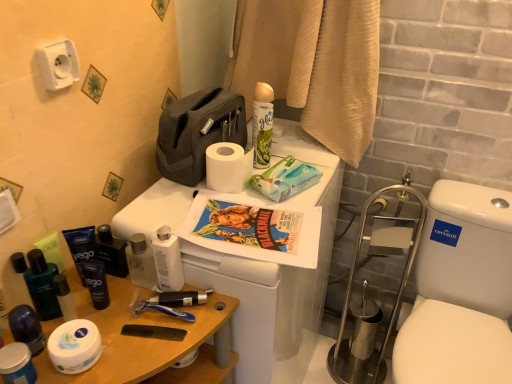
The image size is (512, 384). Find the location of `white matte toilet paper at lower left, which ranks as the 2th toilet paper in right-to-left order`. white matte toilet paper at lower left, which ranks as the 2th toilet paper in right-to-left order is located at coordinates (74, 346).

At what (x,y) coordinates should I click in order to perform the action: click on matte white jar at lower left, placed as the third toiletry when sorted from left to right. Please return your answer as a coordinate pair (x, y). The height and width of the screenshot is (384, 512). Looking at the image, I should click on (17, 364).

Consider the image. Measure the distance between point [30,353] and camera.

Point [30,353] is 28.43 inches away from camera.

What do you see at coordinates (285, 179) in the screenshot? The width and height of the screenshot is (512, 384). I see `white paper towels at center` at bounding box center [285, 179].

You are a GUI agent. You are given a task and a screenshot of the screen. Output one action in this format:
    pyautogui.click(x=<x>, y=<y>)
    Task: Click on the white glossy toilet seat at right
    The height and width of the screenshot is (384, 512).
    Given the screenshot: What is the action you would take?
    pyautogui.click(x=460, y=291)

Can we say matte black shaving cream at left, which is counted as the third toiletry, starting from the right, lies outside white glossy toilet seat at right?

matte black shaving cream at left, which is counted as the third toiletry, starting from the right, lies outside white glossy toilet seat at right's area.

Considering the sizes of objects matte black shaving cream at left, which appears as the 5th toiletry when viewed from the left, and white glossy toilet seat at right in the image provided, who is bigger, matte black shaving cream at left, which appears as the 5th toiletry when viewed from the left, or white glossy toilet seat at right?

white glossy toilet seat at right is bigger.

Is the depth of matte black shaving cream at left, which is counted as the third toiletry, starting from the right, greater than that of white glossy toilet seat at right?

That is True.

Considering the relative sizes of matte black shaving cream at left, which is counted as the third toiletry, starting from the right, and white glossy toilet seat at right in the image provided, is matte black shaving cream at left, which is counted as the third toiletry, starting from the right, thinner than white glossy toilet seat at right?

Indeed, matte black shaving cream at left, which is counted as the third toiletry, starting from the right, has a lesser width compared to white glossy toilet seat at right.

Between shiny black bottles at lower left, which appears as the 1th toiletry when viewed from the left, and white matte lotion at center, which appears as the seventh toiletry when viewed from the left, which one has smaller size?

Smaller between the two is shiny black bottles at lower left, which appears as the 1th toiletry when viewed from the left.

Is shiny black bottles at lower left, marked as the 7th toiletry in a right-to-left arrangement, oriented towards white matte lotion at center, the 1th toiletry when ordered from right to left?

No, shiny black bottles at lower left, marked as the 7th toiletry in a right-to-left arrangement, is not facing towards white matte lotion at center, the 1th toiletry when ordered from right to left.

How many degrees apart are the facing directions of shiny black bottles at lower left, marked as the 7th toiletry in a right-to-left arrangement, and white matte lotion at center, the 1th toiletry when ordered from right to left?

The angle between the facing direction of shiny black bottles at lower left, marked as the 7th toiletry in a right-to-left arrangement, and the facing direction of white matte lotion at center, the 1th toiletry when ordered from right to left, is 88 degrees.

Is the position of shiny black bottles at lower left, marked as the 7th toiletry in a right-to-left arrangement, less distant than that of white matte lotion at center, which appears as the seventh toiletry when viewed from the left?

Yes, the depth of shiny black bottles at lower left, marked as the 7th toiletry in a right-to-left arrangement, is less than that of white matte lotion at center, which appears as the seventh toiletry when viewed from the left.

You are a GUI agent. You are given a task and a screenshot of the screen. Output one action in this format:
    pyautogui.click(x=<x>, y=<y>)
    Task: Click on the table in front of the dark blue matte tube at left, which ranks as the sixth toiletry in left-to-right order
    The width and height of the screenshot is (512, 384).
    Given the screenshot: What is the action you would take?
    pyautogui.click(x=150, y=341)

Is dark blue matte tube at left, which ranks as the sixth toiletry in left-to-right order, wider or thinner than wooden table at lower left?

In the image, dark blue matte tube at left, which ranks as the sixth toiletry in left-to-right order, appears to be more narrow than wooden table at lower left.

Is dark blue matte tube at left, marked as the 2th toiletry in a right-to-left arrangement, to the left of wooden table at lower left from the viewer's perspective?

Yes.

Is dark blue matte tube at left, which ranks as the sixth toiletry in left-to-right order, placed right next to wooden table at lower left?

dark blue matte tube at left, which ranks as the sixth toiletry in left-to-right order, is not next to wooden table at lower left, and they're not touching.

From a real-world perspective, is white paper towels at center above or below green matte spray can at upper center?

From a real-world perspective, white paper towels at center is physically below green matte spray can at upper center.

From the picture: Is white paper towels at center wider than green matte spray can at upper center?

Yes.

From the picture: How different are the orientations of white paper towels at center and green matte spray can at upper center in degrees?

14.5 degrees.

Which is in front, white paper towels at center or green matte spray can at upper center?

white paper towels at center is closer to the camera.

How many degrees apart are the facing directions of white matte lotion at center, which appears as the seventh toiletry when viewed from the left, and dark blue matte tube at left, which ranks as the sixth toiletry in left-to-right order?

white matte lotion at center, which appears as the seventh toiletry when viewed from the left, and dark blue matte tube at left, which ranks as the sixth toiletry in left-to-right order, are facing 13.4 degrees away from each other.

Based on the photo, between white matte lotion at center, the 1th toiletry when ordered from right to left, and dark blue matte tube at left, marked as the 2th toiletry in a right-to-left arrangement, which one is positioned in front?

Positioned in front is white matte lotion at center, the 1th toiletry when ordered from right to left.

Can we say white matte lotion at center, which appears as the seventh toiletry when viewed from the left, lies outside dark blue matte tube at left, which ranks as the sixth toiletry in left-to-right order?

Yes, white matte lotion at center, which appears as the seventh toiletry when viewed from the left, is located beyond the bounds of dark blue matte tube at left, which ranks as the sixth toiletry in left-to-right order.

In the scene shown: From the image's perspective, is white matte lotion at center, which appears as the seventh toiletry when viewed from the left, under dark blue matte tube at left, marked as the 2th toiletry in a right-to-left arrangement?

No.

Considering the sizes of objects wooden table at lower left and matte black shaving cream at left, positioned as the 2th toiletry in left-to-right order, in the image provided, who is bigger, wooden table at lower left or matte black shaving cream at left, positioned as the 2th toiletry in left-to-right order,?

Bigger between the two is wooden table at lower left.

Based on the photo, which is in front, wooden table at lower left or matte black shaving cream at left, positioned as the 2th toiletry in left-to-right order?

wooden table at lower left is more forward.

From the image's perspective, is wooden table at lower left positioned above or below matte black shaving cream at left, positioned as the sixth toiletry in right-to-left order?

wooden table at lower left is below matte black shaving cream at left, positioned as the sixth toiletry in right-to-left order.

Is wooden table at lower left positioned far away from matte black shaving cream at left, positioned as the sixth toiletry in right-to-left order?

No, wooden table at lower left is not far away from matte black shaving cream at left, positioned as the sixth toiletry in right-to-left order.

Is white matte toilet paper at center, the 1th toilet paper positioned from the right, thinner than blue matte tube at left, which is the 4th toiletry from right to left?

Incorrect, the width of white matte toilet paper at center, the 1th toilet paper positioned from the right, is not less than that of blue matte tube at left, which is the 4th toiletry from right to left.

Relative to blue matte tube at left, positioned as the 4th toiletry in left-to-right order, is white matte toilet paper at center, the 1th toilet paper positioned from the right, in front or behind?

white matte toilet paper at center, the 1th toilet paper positioned from the right, is behind blue matte tube at left, positioned as the 4th toiletry in left-to-right order.

Who is smaller, white matte toilet paper at center, which is the first toilet paper from back to front, or blue matte tube at left, which is the 4th toiletry from right to left?

blue matte tube at left, which is the 4th toiletry from right to left, is smaller.

Between white matte toilet paper at center, placed as the first toilet paper when sorted from top to bottom, and blue matte tube at left, which is the 4th toiletry from right to left, which one appears on the left side from the viewer's perspective?

blue matte tube at left, which is the 4th toiletry from right to left.

In the image, there is a matte black shaving cream at left, which appears as the 5th toiletry when viewed from the left. What are the coordinates of `sit below it (from a real-world perspective)` in the screenshot? It's located at [x=460, y=291].

The width and height of the screenshot is (512, 384). Identify the location of the 4th toiletry directly above the shiny black bottles at lower left, which appears as the 1th toiletry when viewed from the left (from a real-world perspective). (167, 260).

Based on their spatial positions, is blue matte tube at left, positioned as the 4th toiletry in left-to-right order, or white glossy toilet seat at right further from matte white jar at lower left, placed as the third toiletry when sorted from left to right?

white glossy toilet seat at right is further to matte white jar at lower left, placed as the third toiletry when sorted from left to right.

When comparing their distances from white matte toilet paper at lower left, which is the first toilet paper from bottom to top, does green matte spray can at upper center or dark blue matte tube at left, marked as the 2th toiletry in a right-to-left arrangement, seem closer?

dark blue matte tube at left, marked as the 2th toiletry in a right-to-left arrangement.

Based on their spatial positions, is green matte spray can at upper center or white paper towels at center closer to white matte toilet paper at center, the 1th toilet paper positioned from the right?

Among the two, white paper towels at center is located nearer to white matte toilet paper at center, the 1th toilet paper positioned from the right.

Based on their spatial positions, is white plastic toilet at upper center or white paper towels at center further from dark blue matte tube at left, which ranks as the sixth toiletry in left-to-right order?

white paper towels at center.

Considering their positions, is matte white jar at lower left, placed as the third toiletry when sorted from left to right, positioned closer to white plastic toilet at upper center than shiny black bottles at lower left, which appears as the 1th toiletry when viewed from the left?

Among the two, shiny black bottles at lower left, which appears as the 1th toiletry when viewed from the left, is located nearer to white plastic toilet at upper center.

Estimate the real-world distances between objects in this image. Which object is closer to white matte toilet paper at center, the 2th toilet paper in the bottom-to-top sequence, matte black shaving cream at left, which appears as the 5th toiletry when viewed from the left, or shiny black bottles at lower left, marked as the 7th toiletry in a right-to-left arrangement?

matte black shaving cream at left, which appears as the 5th toiletry when viewed from the left.

Looking at the image, which one is located closer to white plastic toilet at upper center, shiny black bottles at lower left, which appears as the 1th toiletry when viewed from the left, or matte white jar at lower left, placed as the third toiletry when sorted from left to right?

shiny black bottles at lower left, which appears as the 1th toiletry when viewed from the left.

Considering their positions, is dark blue matte tube at left, which ranks as the sixth toiletry in left-to-right order, positioned further to white plastic toilet at upper center than white matte toilet paper at center, the 1th toilet paper positioned from the right?

Among the two, dark blue matte tube at left, which ranks as the sixth toiletry in left-to-right order, is located further to white plastic toilet at upper center.

Where is `table situated between matte black shaving cream at left, which appears as the 5th toiletry when viewed from the left, and white glossy toilet seat at right from left to right`? table situated between matte black shaving cream at left, which appears as the 5th toiletry when viewed from the left, and white glossy toilet seat at right from left to right is located at coordinates (150, 341).

The image size is (512, 384). Identify the location of toiletry between green matte spray can at upper center and white matte lotion at center, the 1th toiletry when ordered from right to left, vertically. (111, 252).

I want to click on counter top situated between dark blue matte tube at left, marked as the 2th toiletry in a right-to-left arrangement, and white paper towels at center from left to right, so (276, 278).

The width and height of the screenshot is (512, 384). In order to click on mouthwash situated between white matte toilet paper at lower left, the 1th toilet paper in the left-to-right sequence, and white glossy toilet seat at right from left to right in this screenshot , I will do `click(262, 124)`.